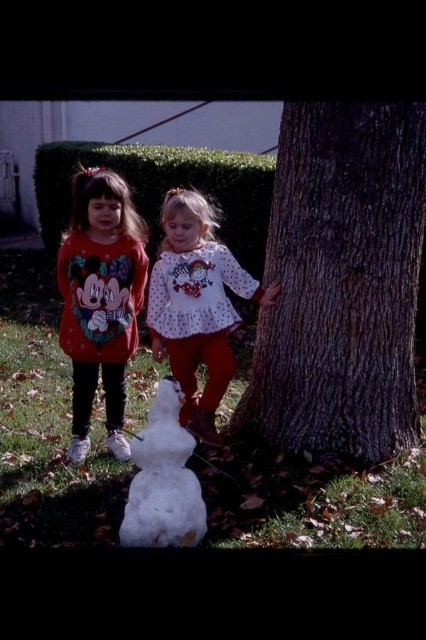
Question: Which point is farther to the camera?

Choices:
 (A) white dotted shirt at center
 (B) dark brown textured bark at center
 (C) white fluffy snowman at center

Answer: (A)

Question: Which point is farther to the camera?

Choices:
 (A) (164, 470)
 (B) (296, 252)

Answer: (B)

Question: Can you confirm if white dotted shirt at center is wider than white fluffy snowman at center?

Choices:
 (A) yes
 (B) no

Answer: (A)

Question: Does dark brown textured bark at center lie behind matte red sweatshirt at left?

Choices:
 (A) yes
 (B) no

Answer: (B)

Question: Which point is closer to the camera?

Choices:
 (A) matte red sweatshirt at left
 (B) dark brown textured bark at center

Answer: (B)

Question: Is dark brown textured bark at center positioned before matte red sweatshirt at left?

Choices:
 (A) no
 (B) yes

Answer: (B)